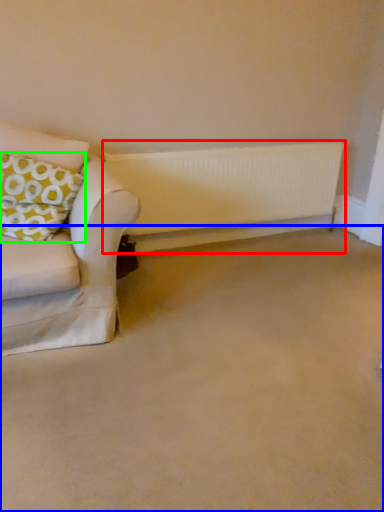
Question: Which is farther away from radiator (highlighted by a red box)? plain (highlighted by a blue box) or pillow (highlighted by a green box)?

Choices:
 (A) plain
 (B) pillow

Answer: (A)